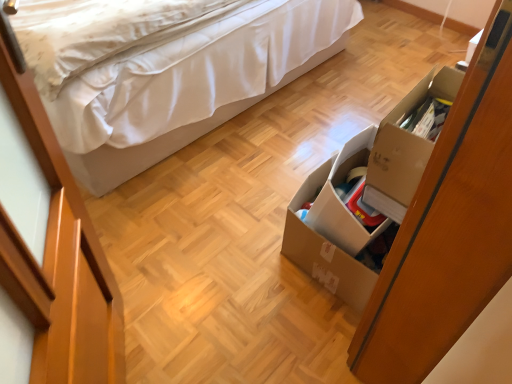
Question: From the image's perspective, is white fabric bed at upper left beneath brown cardboard box at lower right?

Choices:
 (A) no
 (B) yes

Answer: (A)

Question: Considering the relative sizes of white fabric bed at upper left and brown cardboard box at lower right in the image provided, is white fabric bed at upper left shorter than brown cardboard box at lower right?

Choices:
 (A) no
 (B) yes

Answer: (A)

Question: Is white fabric bed at upper left far from brown cardboard box at lower right?

Choices:
 (A) no
 (B) yes

Answer: (A)

Question: Does white fabric bed at upper left lie in front of brown cardboard box at lower right?

Choices:
 (A) yes
 (B) no

Answer: (A)

Question: From a real-world perspective, is white fabric bed at upper left physically above brown cardboard box at lower right?

Choices:
 (A) no
 (B) yes

Answer: (B)

Question: From a real-world perspective, is brown cardboard box at lower right above or below white fabric bed at upper left?

Choices:
 (A) below
 (B) above

Answer: (A)

Question: Is point (333, 236) positioned closer to the camera than point (161, 139)?

Choices:
 (A) farther
 (B) closer

Answer: (B)

Question: Considering the relative positions of brown cardboard box at lower right and white fabric bed at upper left in the image provided, is brown cardboard box at lower right to the left or to the right of white fabric bed at upper left?

Choices:
 (A) right
 (B) left

Answer: (A)

Question: From the image's perspective, is brown cardboard box at lower right located above or below white fabric bed at upper left?

Choices:
 (A) below
 (B) above

Answer: (A)

Question: Considering the positions of cardboard box at right and brown cardboard box at lower right in the image, is cardboard box at right bigger or smaller than brown cardboard box at lower right?

Choices:
 (A) big
 (B) small

Answer: (A)

Question: Considering their positions, is cardboard box at right located in front of or behind brown cardboard box at lower right?

Choices:
 (A) behind
 (B) front

Answer: (B)

Question: In terms of height, does cardboard box at right look taller or shorter compared to brown cardboard box at lower right?

Choices:
 (A) tall
 (B) short

Answer: (A)

Question: From the image's perspective, is cardboard box at right located above or below brown cardboard box at lower right?

Choices:
 (A) below
 (B) above

Answer: (B)

Question: Is point (216, 109) closer or farther from the camera than point (436, 284)?

Choices:
 (A) farther
 (B) closer

Answer: (A)

Question: Which is correct: white fabric bed at upper left is inside cardboard box at right, or outside of it?

Choices:
 (A) inside
 (B) outside

Answer: (B)